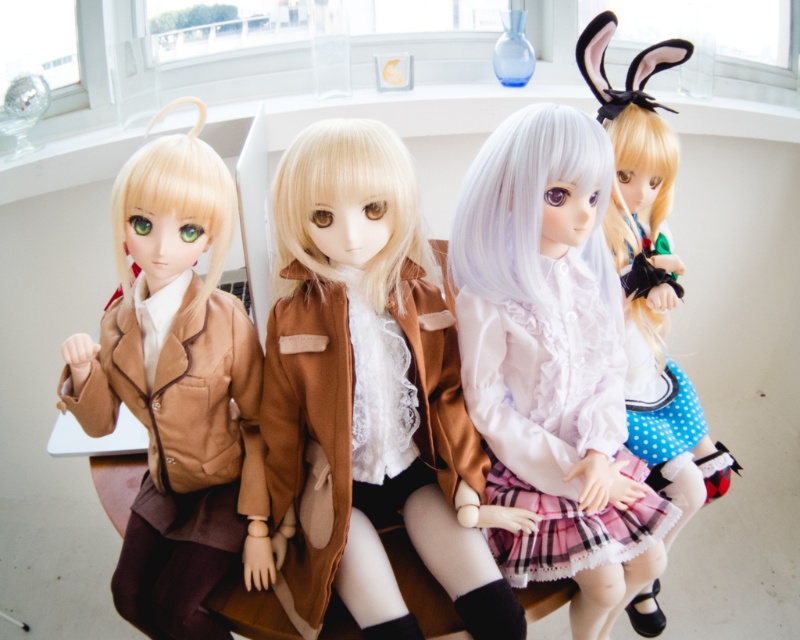
Who is more distant from viewer, (374, 125) or (641, 442)?

The point (641, 442) is more distant.

Is satin brown coat at center smaller than white matte wig at upper right?

Yes, satin brown coat at center is smaller than white matte wig at upper right.

Where is `satin brown coat at center`? satin brown coat at center is located at coordinates (368, 394).

Can you confirm if matte white wig at center is positioned below white matte wig at upper right?

Indeed, matte white wig at center is positioned under white matte wig at upper right.

Between matte white wig at center and white matte wig at upper right, which one appears on the right side from the viewer's perspective?

From the viewer's perspective, white matte wig at upper right appears more on the right side.

Locate an element on the screen. The width and height of the screenshot is (800, 640). matte white wig at center is located at coordinates (550, 358).

At what (x,y) coordinates should I click in order to perform the action: click on matte white wig at center. Please return your answer as a coordinate pair (x, y). Image resolution: width=800 pixels, height=640 pixels. Looking at the image, I should click on (550, 358).

Looking at this image, is the position of matte brown jacket at left less distant than that of white matte wig at upper right?

Yes, it is.

Is point (200, 301) farther from viewer compared to point (652, 182)?

No, it is in front of (652, 182).

You are a GUI agent. You are given a task and a screenshot of the screen. Output one action in this format:
    pyautogui.click(x=<x>, y=<y>)
    Task: Click on the matte brown jacket at left
    The height and width of the screenshot is (640, 800).
    Given the screenshot: What is the action you would take?
    pyautogui.click(x=178, y=388)